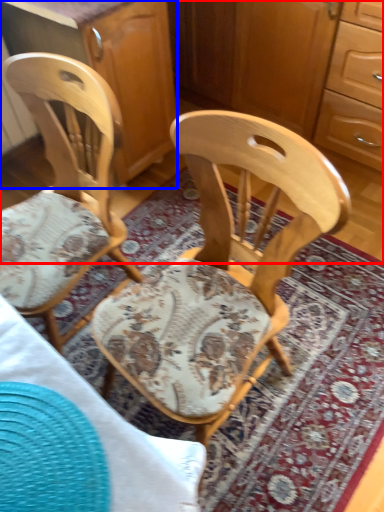
Question: Which of the following is the farthest to the observer, dresser (highlighted by a red box) or cabinetry (highlighted by a blue box)?

Choices:
 (A) dresser
 (B) cabinetry

Answer: (A)